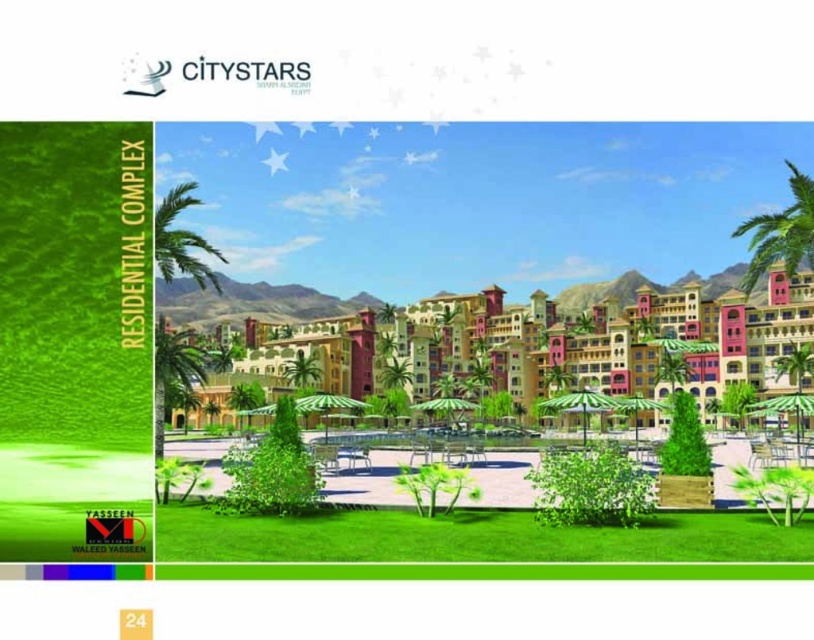
Question: From the image, what is the correct spatial relationship of green leafy palm tree at right in relation to green leafy palm tree at center?

Choices:
 (A) left
 (B) right

Answer: (B)

Question: Does green grass at center have a lesser width compared to green leafy palm tree at right?

Choices:
 (A) yes
 (B) no

Answer: (A)

Question: Does green leafy palm tree at right appear on the left side of green leafy palm tree at center?

Choices:
 (A) no
 (B) yes

Answer: (A)

Question: Which object is the closest to the green leafy palm tree at right?

Choices:
 (A) multicolored stucco buildings at center
 (B) green leafy palm tree at center

Answer: (B)

Question: Among these points, which one is farthest from the camera?

Choices:
 (A) (368, 364)
 (B) (191, 545)
 (C) (759, 253)

Answer: (A)

Question: Which point appears closest to the camera in this image?

Choices:
 (A) (749, 228)
 (B) (791, 340)
 (C) (629, 532)

Answer: (C)